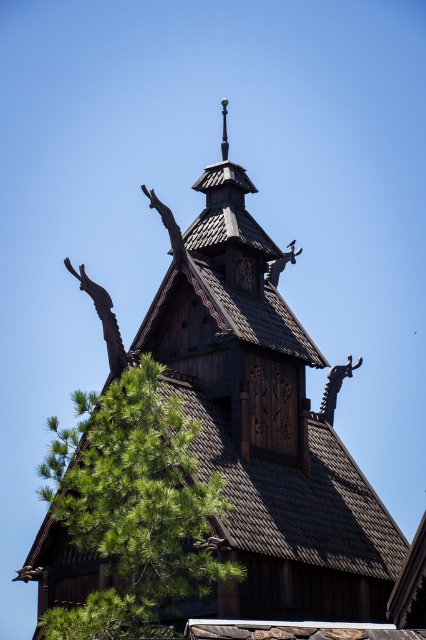
You are standing in front of the Scandinavian building and notice a green leafy tree at lower left and a brown wooden roof at center. Which object appears wider from your viewpoint?

The green leafy tree at lower left appears wider than the brown wooden roof at center because its width is larger than the roof.

You are standing in front of the building and notice the green leafy tree at lower left and the brown wooden roof at center. Which object is taller from your viewpoint?

The green leafy tree at lower left is taller than the brown wooden roof at center.